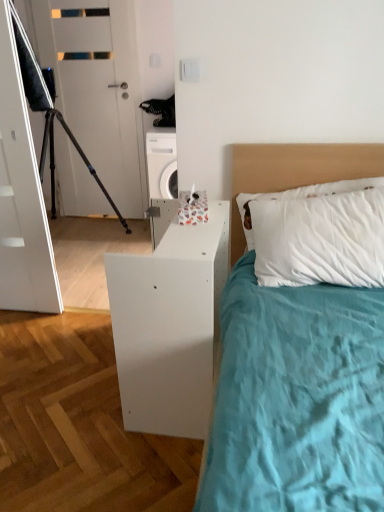
I want to click on white matte door at upper left, so click(101, 92).

Considering the relative sizes of white matte headboard at upper right and black matte tripod at left in the image provided, is white matte headboard at upper right bigger than black matte tripod at left?

Incorrect, white matte headboard at upper right is not larger than black matte tripod at left.

Could you tell me if white matte headboard at upper right is turned towards black matte tripod at left?

No, white matte headboard at upper right is not facing towards black matte tripod at left.

Measure the distance from white matte headboard at upper right to black matte tripod at left.

The distance of white matte headboard at upper right from black matte tripod at left is 1.89 meters.

Is white matte headboard at upper right situated inside black matte tripod at left or outside?

white matte headboard at upper right is located beyond the bounds of black matte tripod at left.

From a real-world perspective, who is located higher, black matte tripod at left or white matte door at upper left?

white matte door at upper left is physically above.

From the image's perspective, which one is positioned higher, black matte tripod at left or white matte door at upper left?

white matte door at upper left, from the image's perspective.

Is black matte tripod at left behind white matte door at upper left?

That is False.

Does black matte tripod at left turn towards white matte door at upper left?

No, black matte tripod at left is not oriented towards white matte door at upper left.

Considering the positions of point (58, 48) and point (160, 271), is point (58, 48) closer or farther from the camera than point (160, 271)?

Point (58, 48).

You are a GUI agent. You are given a task and a screenshot of the screen. Output one action in this format:
    pyautogui.click(x=<x>, y=<y>)
    Task: Click on the nightstand located in front of the white matte door at upper left
    
    Given the screenshot: What is the action you would take?
    pyautogui.click(x=169, y=326)

Considering the sizes of white matte door at upper left and white matte nightstand at lower right in the image, is white matte door at upper left taller or shorter than white matte nightstand at lower right?

Clearly, white matte door at upper left is taller compared to white matte nightstand at lower right.

Does white matte door at upper left turn towards white matte nightstand at lower right?

No, white matte door at upper left is not aimed at white matte nightstand at lower right.

Which object is positioned more to the left, black matte tripod at left or white matte nightstand at lower right?

black matte tripod at left.

Is black matte tripod at left thinner than white matte nightstand at lower right?

In fact, black matte tripod at left might be wider than white matte nightstand at lower right.

Can white matte nightstand at lower right be found inside black matte tripod at left?

No, black matte tripod at left does not contain white matte nightstand at lower right.

From the image's perspective, between black matte tripod at left and white matte nightstand at lower right, who is located below?

white matte nightstand at lower right, from the image's perspective.

I want to click on headboard lying on the right of white matte door at upper left, so click(x=295, y=172).

Is white matte headboard at upper right oriented away from white matte door at upper left?

white matte headboard at upper right is not turned away from white matte door at upper left.

How far apart are white matte headboard at upper right and white matte door at upper left?

white matte headboard at upper right is 6.36 feet from white matte door at upper left.

From the image's perspective, relative to white matte door at upper left, is white matte headboard at upper right above or below?

white matte headboard at upper right is situated lower than white matte door at upper left in the image.

Which object is closer to the camera taking this photo, white matte nightstand at lower right or white matte headboard at upper right?

white matte nightstand at lower right is in front.

Consider the image. From a real-world perspective, is white matte nightstand at lower right located beneath white matte headboard at upper right?

Yes.

Does point (167, 294) appear closer or farther from the camera than point (232, 192)?

Point (167, 294).

Can you tell me how much white matte nightstand at lower right and white matte headboard at upper right differ in facing direction?

85 degrees separate the facing orientations of white matte nightstand at lower right and white matte headboard at upper right.

What are the coordinates of `tripod below the white matte door at upper left (from the image's perspective)` in the screenshot? It's located at (80, 156).

Which is more distant, (73, 41) or (52, 109)?

Point (73, 41)

From a real-world perspective, which is physically above, white matte door at upper left or black matte tripod at left?

white matte door at upper left.

Is white matte door at upper left far away from black matte tripod at left?

Actually, white matte door at upper left and black matte tripod at left are a little close together.

Where is `headboard on the right of the black matte tripod at left`? This screenshot has width=384, height=512. headboard on the right of the black matte tripod at left is located at coordinates tap(295, 172).

Find the location of a particular element. The image size is (384, 512). tripod in front of the white matte door at upper left is located at coordinates (80, 156).

Estimate the real-world distances between objects in this image. Which object is further from black matte tripod at left, white matte headboard at upper right or white matte door at upper left?

white matte headboard at upper right lies further to black matte tripod at left than the other object.

Looking at the image, which one is located closer to white matte door at upper left, white matte nightstand at lower right or black matte tripod at left?

black matte tripod at left lies closer to white matte door at upper left than the other object.

From the image, which object appears to be farther from white matte headboard at upper right, white matte door at upper left or black matte tripod at left?

white matte door at upper left.

When comparing their distances from black matte tripod at left, does white matte headboard at upper right or white matte nightstand at lower right seem further?

white matte nightstand at lower right.

Which object lies further to the anchor point black matte tripod at left, white matte nightstand at lower right or white matte door at upper left?

Among the two, white matte nightstand at lower right is located further to black matte tripod at left.

When comparing their distances from white matte nightstand at lower right, does black matte tripod at left or white matte headboard at upper right seem closer?

Among the two, white matte headboard at upper right is located nearer to white matte nightstand at lower right.

Looking at the image, which one is located further to black matte tripod at left, white matte door at upper left or white matte nightstand at lower right?

The object further to black matte tripod at left is white matte nightstand at lower right.

Based on their spatial positions, is white matte headboard at upper right or white matte door at upper left further from white matte nightstand at lower right?

white matte door at upper left is further to white matte nightstand at lower right.

Locate an element on the screen. This screenshot has width=384, height=512. tripod between white matte door at upper left and white matte headboard at upper right from left to right is located at coordinates (80, 156).

Identify the location of tripod located between white matte nightstand at lower right and white matte door at upper left in the depth direction. The image size is (384, 512). (80, 156).

At what (x,y) coordinates should I click in order to perform the action: click on headboard positioned between white matte nightstand at lower right and black matte tripod at left from near to far. Please return your answer as a coordinate pair (x, y). This screenshot has height=512, width=384. Looking at the image, I should click on (295, 172).

Where is `headboard positioned between white matte nightstand at lower right and white matte door at upper left from near to far`? This screenshot has width=384, height=512. headboard positioned between white matte nightstand at lower right and white matte door at upper left from near to far is located at coordinates (295, 172).